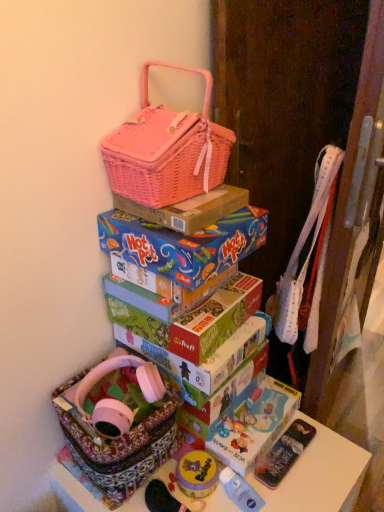
Question: Is floral fabric basket at lower left placed right next to patterned fabric basket at lower left?

Choices:
 (A) yes
 (B) no

Answer: (B)

Question: Considering the relative sizes of floral fabric basket at lower left and patterned fabric basket at lower left in the image provided, is floral fabric basket at lower left wider than patterned fabric basket at lower left?

Choices:
 (A) no
 (B) yes

Answer: (A)

Question: Does floral fabric basket at lower left lie behind patterned fabric basket at lower left?

Choices:
 (A) yes
 (B) no

Answer: (A)

Question: From the image's perspective, is floral fabric basket at lower left on patterned fabric basket at lower left?

Choices:
 (A) yes
 (B) no

Answer: (A)

Question: Does floral fabric basket at lower left have a lesser height compared to patterned fabric basket at lower left?

Choices:
 (A) no
 (B) yes

Answer: (B)

Question: From the image's perspective, relative to blue cardboard hot pot box at center, placed as the 1th box when sorted from bottom to top, is patterned fabric basket at lower left above or below?

Choices:
 (A) below
 (B) above

Answer: (A)

Question: In terms of width, does patterned fabric basket at lower left look wider or thinner when compared to blue cardboard hot pot box at center, placed as the 1th box when sorted from bottom to top?

Choices:
 (A) thin
 (B) wide

Answer: (B)

Question: Is patterned fabric basket at lower left inside or outside of blue cardboard hot pot box at center, placed as the 1th box when sorted from bottom to top?

Choices:
 (A) inside
 (B) outside

Answer: (B)

Question: From a real-world perspective, is patterned fabric basket at lower left above or below blue cardboard hot pot box at center, which appears as the second box when viewed from the top?

Choices:
 (A) above
 (B) below

Answer: (B)

Question: Considering the positions of patterned fabric basket at lower left and floral fabric basket at lower left in the image, is patterned fabric basket at lower left wider or thinner than floral fabric basket at lower left?

Choices:
 (A) wide
 (B) thin

Answer: (A)

Question: From the image's perspective, is patterned fabric basket at lower left positioned above or below floral fabric basket at lower left?

Choices:
 (A) above
 (B) below

Answer: (B)

Question: Considering the relative positions of patterned fabric basket at lower left and floral fabric basket at lower left in the image provided, is patterned fabric basket at lower left to the left or to the right of floral fabric basket at lower left?

Choices:
 (A) left
 (B) right

Answer: (B)

Question: Is patterned fabric basket at lower left taller or shorter than floral fabric basket at lower left?

Choices:
 (A) tall
 (B) short

Answer: (A)

Question: Considering the positions of matte plastic toy at lower center and blue cardboard hot pot box at center, which appears as the second box when viewed from the top, in the image, is matte plastic toy at lower center wider or thinner than blue cardboard hot pot box at center, which appears as the second box when viewed from the top,?

Choices:
 (A) thin
 (B) wide

Answer: (A)

Question: From the image's perspective, is matte plastic toy at lower center positioned above or below blue cardboard hot pot box at center, which appears as the second box when viewed from the top?

Choices:
 (A) below
 (B) above

Answer: (A)